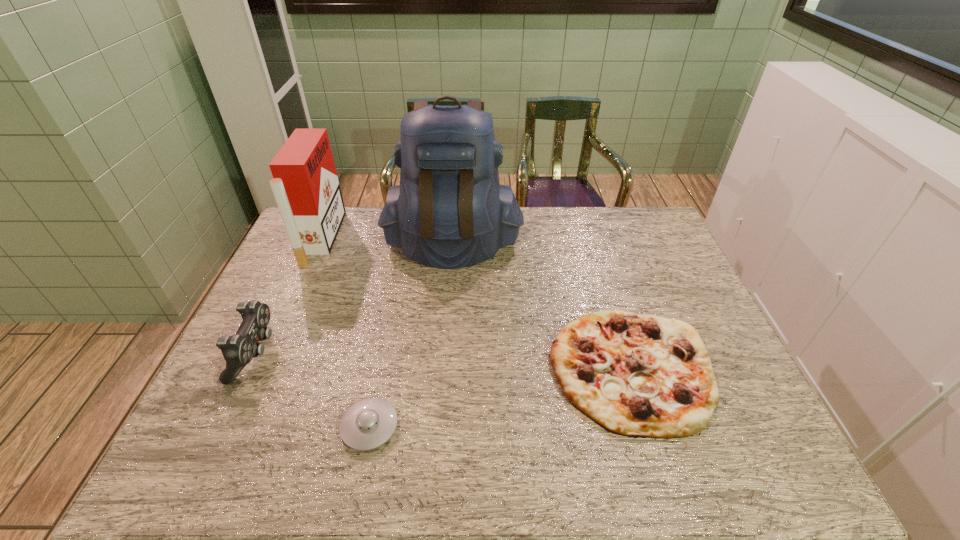
I want to click on the tallest object, so click(449, 211).

You are a GUI agent. You are given a task and a screenshot of the screen. Output one action in this format:
    pyautogui.click(x=<x>, y=<y>)
    Task: Click on the cigarette case
    The image size is (960, 540).
    Given the screenshot: What is the action you would take?
    pyautogui.click(x=306, y=188)

At what (x,y) coordinates should I click in order to perform the action: click on control. Please return your answer as a coordinate pair (x, y). The width and height of the screenshot is (960, 540). Looking at the image, I should click on [x=238, y=350].

Locate an element on the screen. Image resolution: width=960 pixels, height=540 pixels. the rightmost object is located at coordinates (634, 375).

You are a GUI agent. You are given a task and a screenshot of the screen. Output one action in this format:
    pyautogui.click(x=<x>, y=<y>)
    Task: Click on the shortest object
    Image resolution: width=960 pixels, height=540 pixels.
    Given the screenshot: What is the action you would take?
    pyautogui.click(x=368, y=424)

Find the location of a particular element. Image resolution: width=960 pixels, height=540 pixels. vacant space located at the front pocket of the tallest object is located at coordinates (448, 294).

Image resolution: width=960 pixels, height=540 pixels. In order to click on free space located on the front-facing side of the cigarette case in this screenshot , I will do `click(414, 238)`.

This screenshot has width=960, height=540. I want to click on vacant area situated 0.280m on the surface of the third tallest object with buttons, so click(379, 354).

This screenshot has height=540, width=960. What are the coordinates of `blank space located 0.100m on the back of the pizza` in the screenshot? It's located at (607, 288).

This screenshot has height=540, width=960. Find the location of `blank space located 0.130m on the right of the saucer`. blank space located 0.130m on the right of the saucer is located at coordinates (455, 427).